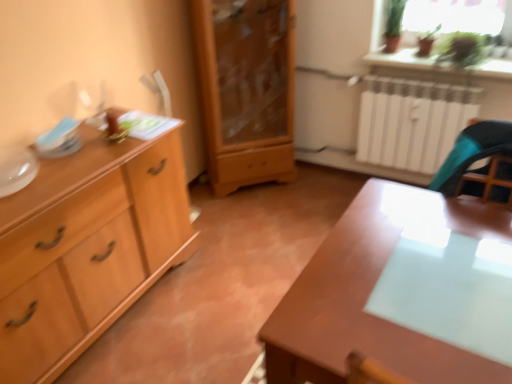
What do you see at coordinates (370, 293) in the screenshot? I see `glossy wood table at center` at bounding box center [370, 293].

Find the location of a particular element. The image size is (512, 384). light wood cabinet at left, positioned as the 2th chest of drawers in right-to-left order is located at coordinates (87, 247).

Find the location of `green leafy plant at upper right`. green leafy plant at upper right is located at coordinates (406, 60).

Find the location of a particular element. The image size is (512, 384). light wood cabinet at center, the 2th chest of drawers in the left-to-right sequence is located at coordinates (246, 89).

Can you confirm if light wood cabinet at left, the 1th chest of drawers positioned from the left, is positioned to the right of light wood cabinet at center, arranged as the 1th chest of drawers when viewed from the right?

No.

Considering the relative sizes of light wood cabinet at left, positioned as the 2th chest of drawers in right-to-left order, and light wood cabinet at center, the 2th chest of drawers in the left-to-right sequence, in the image provided, is light wood cabinet at left, positioned as the 2th chest of drawers in right-to-left order, taller than light wood cabinet at center, the 2th chest of drawers in the left-to-right sequence,?

No.

Is the depth of light wood cabinet at left, the 1th chest of drawers positioned from the left, greater than that of light wood cabinet at center, the 2th chest of drawers in the left-to-right sequence?

That is False.

Are light wood cabinet at left, the 1th chest of drawers positioned from the left, and light wood cabinet at center, arranged as the 1th chest of drawers when viewed from the right, far apart?

Yes.

From the image's perspective, does green leafy plant at upper right appear lower than light wood cabinet at left, the 1th chest of drawers positioned from the left?

Actually, green leafy plant at upper right appears above light wood cabinet at left, the 1th chest of drawers positioned from the left, in the image.

Does green leafy plant at upper right have a greater height compared to light wood cabinet at left, the 1th chest of drawers positioned from the left?

In fact, green leafy plant at upper right may be shorter than light wood cabinet at left, the 1th chest of drawers positioned from the left.

Is green leafy plant at upper right not near light wood cabinet at left, the 1th chest of drawers positioned from the left?

Indeed, green leafy plant at upper right is not near light wood cabinet at left, the 1th chest of drawers positioned from the left.

The image size is (512, 384). There is a green leafy plant at upper right. Find the location of `the 2nd chest of drawers below it (from the image's perspective)`. the 2nd chest of drawers below it (from the image's perspective) is located at coordinates (87, 247).

Is light wood cabinet at center, arranged as the 1th chest of drawers when viewed from the right, touching transparent glass table at right?

No, light wood cabinet at center, arranged as the 1th chest of drawers when viewed from the right, is not with transparent glass table at right.

Is light wood cabinet at center, the 2th chest of drawers in the left-to-right sequence, to the left of transparent glass table at right from the viewer's perspective?

Yes, light wood cabinet at center, the 2th chest of drawers in the left-to-right sequence, is to the left of transparent glass table at right.

Between light wood cabinet at center, arranged as the 1th chest of drawers when viewed from the right, and transparent glass table at right, which one has less height?

transparent glass table at right is shorter.

The width and height of the screenshot is (512, 384). Identify the location of the 1st chest of drawers to the left of the transparent glass table at right, counting from the anchor's position. (246, 89).

Is point (390, 62) farther from camera compared to point (336, 231)?

That is True.

Could you tell me if green leafy plant at upper right is facing glossy wood table at center?

No, green leafy plant at upper right is not turned towards glossy wood table at center.

Considering the relative positions of green leafy plant at upper right and glossy wood table at center in the image provided, is green leafy plant at upper right to the left of glossy wood table at center from the viewer's perspective?

In fact, green leafy plant at upper right is to the right of glossy wood table at center.

Considering the relative sizes of green leafy plant at upper right and glossy wood table at center in the image provided, is green leafy plant at upper right wider than glossy wood table at center?

No, green leafy plant at upper right is not wider than glossy wood table at center.

How different are the orientations of green leafy plant at upper right and transparent glass table at right in degrees?

The facing directions of green leafy plant at upper right and transparent glass table at right are 8.53e-05 degrees apart.

Is green leafy plant at upper right completely or partially outside of transparent glass table at right?

Yes, green leafy plant at upper right is located beyond the bounds of transparent glass table at right.

Is the position of green leafy plant at upper right more distant than that of transparent glass table at right?

Yes, it is.

Does light wood cabinet at left, the 1th chest of drawers positioned from the left, lie behind transparent glass table at right?

Yes.

From the image's perspective, is light wood cabinet at left, positioned as the 2th chest of drawers in right-to-left order, above or below transparent glass table at right?

light wood cabinet at left, positioned as the 2th chest of drawers in right-to-left order, is below transparent glass table at right.

From a real-world perspective, is light wood cabinet at left, positioned as the 2th chest of drawers in right-to-left order, physically below transparent glass table at right?

Yes, from a real-world perspective, light wood cabinet at left, positioned as the 2th chest of drawers in right-to-left order, is beneath transparent glass table at right.

Does light wood cabinet at left, the 1th chest of drawers positioned from the left, have a lesser width compared to transparent glass table at right?

Indeed, light wood cabinet at left, the 1th chest of drawers positioned from the left, has a lesser width compared to transparent glass table at right.

Can you confirm if light wood cabinet at left, the 1th chest of drawers positioned from the left, is smaller than glossy wood table at center?

Yes.

Does point (54, 214) come in front of point (352, 265)?

No, (54, 214) is behind (352, 265).

Can you confirm if light wood cabinet at left, the 1th chest of drawers positioned from the left, is thinner than glossy wood table at center?

Correct, the width of light wood cabinet at left, the 1th chest of drawers positioned from the left, is less than that of glossy wood table at center.

The width and height of the screenshot is (512, 384). In order to click on the chest of drawers above the light wood cabinet at left, positioned as the 2th chest of drawers in right-to-left order (from the image's perspective) in this screenshot , I will do `click(246, 89)`.

I want to click on the chest of drawers in front of the green leafy plant at upper right, so click(x=87, y=247).

Which object lies nearer to the anchor point glossy wood table at center, transparent glass table at right or light wood cabinet at left, the 1th chest of drawers positioned from the left?

transparent glass table at right is positioned closer to the anchor glossy wood table at center.

From the image, which object appears to be nearer to green leafy plant at upper right, transparent glass table at right or glossy wood table at center?

glossy wood table at center lies closer to green leafy plant at upper right than the other object.

From the image, which object appears to be farther from light wood cabinet at center, the 2th chest of drawers in the left-to-right sequence, glossy wood table at center or transparent glass table at right?

transparent glass table at right.

When comparing their distances from light wood cabinet at left, the 1th chest of drawers positioned from the left, does transparent glass table at right or light wood cabinet at center, the 2th chest of drawers in the left-to-right sequence, seem further?

The object further to light wood cabinet at left, the 1th chest of drawers positioned from the left, is transparent glass table at right.

When comparing their distances from glossy wood table at center, does light wood cabinet at center, the 2th chest of drawers in the left-to-right sequence, or green leafy plant at upper right seem further?

light wood cabinet at center, the 2th chest of drawers in the left-to-right sequence.

Looking at the image, which one is located closer to glossy wood table at center, transparent glass table at right or green leafy plant at upper right?

transparent glass table at right is positioned closer to the anchor glossy wood table at center.

Which object lies further to the anchor point light wood cabinet at left, the 1th chest of drawers positioned from the left, green leafy plant at upper right or transparent glass table at right?

Among the two, green leafy plant at upper right is located further to light wood cabinet at left, the 1th chest of drawers positioned from the left.

Which object lies further to the anchor point transparent glass table at right, light wood cabinet at center, the 2th chest of drawers in the left-to-right sequence, or light wood cabinet at left, positioned as the 2th chest of drawers in right-to-left order?

Based on the image, light wood cabinet at center, the 2th chest of drawers in the left-to-right sequence, appears to be further to transparent glass table at right.

Locate an element on the screen. table between light wood cabinet at left, the 1th chest of drawers positioned from the left, and transparent glass table at right is located at coordinates (370, 293).

Locate an element on the screen. The height and width of the screenshot is (384, 512). the chest of drawers positioned between glossy wood table at center and light wood cabinet at center, the 2th chest of drawers in the left-to-right sequence, from near to far is located at coordinates (87, 247).

Where is `glass table located between glossy wood table at center and green leafy plant at upper right in the depth direction`? The height and width of the screenshot is (384, 512). glass table located between glossy wood table at center and green leafy plant at upper right in the depth direction is located at coordinates (449, 290).

Find the location of `glass table between glossy wood table at center and light wood cabinet at center, the 2th chest of drawers in the left-to-right sequence, in the front-back direction`. glass table between glossy wood table at center and light wood cabinet at center, the 2th chest of drawers in the left-to-right sequence, in the front-back direction is located at coordinates (449, 290).